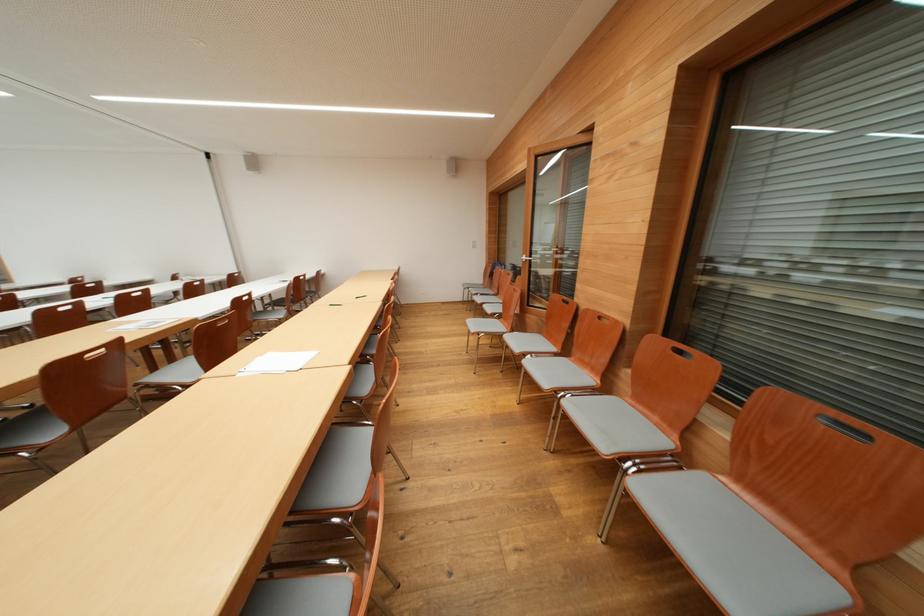
You are a GUI agent. You are given a task and a screenshot of the screen. Output one action in this format:
    pyautogui.click(x=<x>, y=<y>)
    Task: Click on the metal door handle
    The width and height of the screenshot is (924, 616).
    Given the screenshot: What is the action you would take?
    pyautogui.click(x=526, y=257)